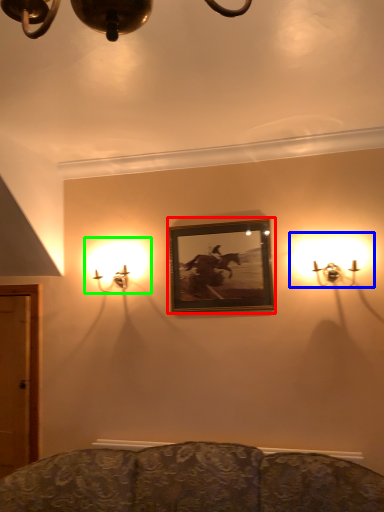
Question: Which is nearer to the picture frame (highlighted by a red box)? lamp (highlighted by a blue box) or lamp (highlighted by a green box).

Choices:
 (A) lamp
 (B) lamp

Answer: (A)